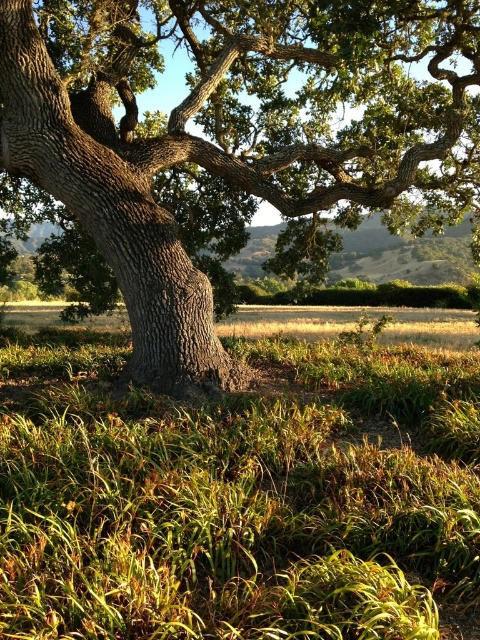
Who is taller, green grass at center or smooth bark oak tree at center?

smooth bark oak tree at center

Based on the photo, does green grass at center have a lesser height compared to smooth bark oak tree at center?

Yes.

Locate an element on the screen. green grass at center is located at coordinates (241, 497).

At what (x,y) coordinates should I click in order to perform the action: click on green grass at center. Please return your answer as a coordinate pair (x, y). Looking at the image, I should click on (241, 497).